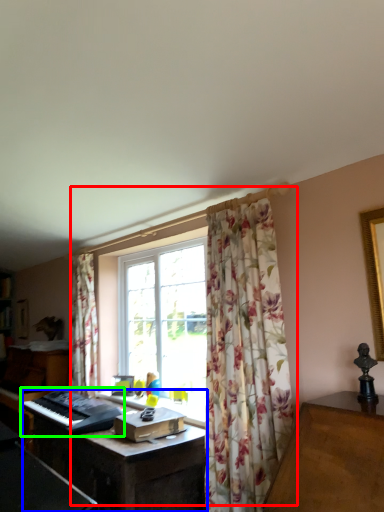
Question: Estimate the real-world distances between objects in this image. Which object is closer to window (highlighted by a red box), computer desk (highlighted by a blue box) or musical keyboard (highlighted by a green box)?

Choices:
 (A) computer desk
 (B) musical keyboard

Answer: (A)